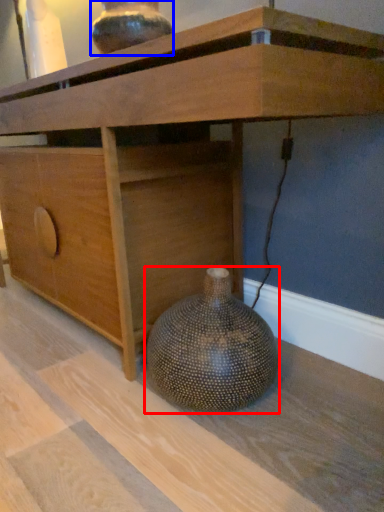
Question: Which object is further to the camera taking this photo, vase (highlighted by a red box) or vase (highlighted by a blue box)?

Choices:
 (A) vase
 (B) vase

Answer: (B)